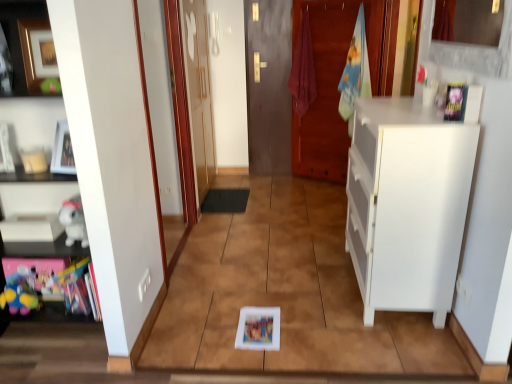
In order to face transparent glass door at upper left, the first door positioned from the left, should I rotate leftwards or rightwards?

Turn left approximately 7.461 degrees to face it.

This screenshot has height=384, width=512. What are the coordinates of `multicolored plush toy at lower left, which is the 1th toy in bottom-to-top order` in the screenshot? It's located at (20, 292).

Image resolution: width=512 pixels, height=384 pixels. Describe the element at coordinates (40, 248) in the screenshot. I see `white matte cabinet at left, marked as the 2th cabinetry in a right-to-left arrangement` at that location.

You are a GUI agent. You are given a task and a screenshot of the screen. Output one action in this format:
    pyautogui.click(x=<x>, y=<y>)
    Task: Click on the blue fabric laundry at center, the 1th laundry in the right-to-left sequence
    
    Given the screenshot: What is the action you would take?
    (x=355, y=71)

What do you see at coordinates (407, 205) in the screenshot? This screenshot has width=512, height=384. I see `white matte cabinet at right, the 2th cabinetry when ordered from left to right` at bounding box center [407, 205].

This screenshot has height=384, width=512. In order to click on white matte cabinet at right, the 2th cabinetry when ordered from left to right in this screenshot , I will do `click(407, 205)`.

What are the coordinates of `transparent glass door at upper left, the first door positioned from the left` in the screenshot? It's located at (198, 92).

At what (x,y) coordinates should I click in order to perform the action: click on cabinetry on the right side of white matte cabinet at left, marked as the 2th cabinetry in a right-to-left arrangement. Please return your answer as a coordinate pair (x, y). The width and height of the screenshot is (512, 384). Looking at the image, I should click on (407, 205).

Could you tell me if white matte cabinet at left, the 1th cabinetry positioned from the left, is facing white matte cabinet at right, the first cabinetry viewed from the right?

No, white matte cabinet at left, the 1th cabinetry positioned from the left, is not oriented towards white matte cabinet at right, the first cabinetry viewed from the right.

Which object is wider, white matte cabinet at left, marked as the 2th cabinetry in a right-to-left arrangement, or white matte cabinet at right, the first cabinetry viewed from the right?

white matte cabinet at right, the first cabinetry viewed from the right.

Looking at this image, can you confirm if white matte cabinet at left, the 1th cabinetry positioned from the left, is positioned to the left of white matte cabinet at right, the 2th cabinetry when ordered from left to right?

Correct, you'll find white matte cabinet at left, the 1th cabinetry positioned from the left, to the left of white matte cabinet at right, the 2th cabinetry when ordered from left to right.

What's the angular difference between white matte cabinet at left, marked as the 2th cabinetry in a right-to-left arrangement, and transparent glass door at upper left, acting as the 2th door starting from the right,'s facing directions?

They differ by 91.3 degrees in their facing directions.

Between white matte cabinet at left, the 1th cabinetry positioned from the left, and transparent glass door at upper left, acting as the 2th door starting from the right, which one appears on the left side from the viewer's perspective?

From the viewer's perspective, white matte cabinet at left, the 1th cabinetry positioned from the left, appears more on the left side.

Which of these two, white matte cabinet at left, the 1th cabinetry positioned from the left, or transparent glass door at upper left, the first door positioned from the left, stands shorter?

white matte cabinet at left, the 1th cabinetry positioned from the left, is shorter.

Considering the positions of points (8, 5) and (191, 113), is point (8, 5) closer to camera compared to point (191, 113)?

That is True.

In the scene shown: From their relative heights in the image, would you say blue fabric laundry at center, the 1th laundry in the right-to-left sequence, is taller or shorter than brown wooden door at center, which appears as the second door when viewed from the left?

Clearly, blue fabric laundry at center, the 1th laundry in the right-to-left sequence, is shorter compared to brown wooden door at center, which appears as the second door when viewed from the left.

From the image's perspective, which object appears higher, blue fabric laundry at center, the 1th laundry in the right-to-left sequence, or brown wooden door at center, which appears as the second door when viewed from the left?

From the image's view, brown wooden door at center, which appears as the second door when viewed from the left, is above.

Find the location of a particular element. This screenshot has height=384, width=512. the 1st laundry located above the brown wooden door at center, which appears as the second door when viewed from the left (from a real-world perspective) is located at coordinates (355, 71).

Is blue fabric laundry at center, the 2th laundry in the left-to-right sequence, not close to brown wooden door at center, which appears as the second door when viewed from the left?

Actually, blue fabric laundry at center, the 2th laundry in the left-to-right sequence, and brown wooden door at center, which appears as the second door when viewed from the left, are a little close together.

Considering the points (10, 299) and (66, 226), which point is in front, point (10, 299) or point (66, 226)?

The point (66, 226) is in front.

In the scene shown: Is multicolored plush toy at lower left, which is the 1th toy in bottom-to-top order, facing away from white plush toy at left, arranged as the 1th toy when viewed from the top?

multicolored plush toy at lower left, which is the 1th toy in bottom-to-top order, does not have its back to white plush toy at left, arranged as the 1th toy when viewed from the top.

Is multicolored plush toy at lower left, acting as the 2th toy starting from the top, in front of white plush toy at left, placed as the second toy when sorted from left to right?

No, multicolored plush toy at lower left, acting as the 2th toy starting from the top, is further to the viewer.

Would you say multicolored plush toy at lower left, marked as the first toy in a left-to-right arrangement, is inside or outside white plush toy at left, marked as the 2th toy in a bottom-to-top arrangement?

The correct answer is: outside.

Is white matte cabinet at right, the 2th cabinetry when ordered from left to right, looking in the opposite direction of matte white picture frame at upper left?

white matte cabinet at right, the 2th cabinetry when ordered from left to right, does not have its back to matte white picture frame at upper left.

This screenshot has width=512, height=384. I want to click on cabinetry that is the 2nd one below the matte white picture frame at upper left (from a real-world perspective), so click(407, 205).

Can you tell me how much white matte cabinet at right, the 2th cabinetry when ordered from left to right, and matte white picture frame at upper left differ in facing direction?

They differ by 119 degrees in their facing directions.

Which is more to the left, white matte cabinet at right, the first cabinetry viewed from the right, or matte white picture frame at upper left?

matte white picture frame at upper left.

Which laundry is the 1st one when counting from the back of the white plush toy at left, placed as the second toy when sorted from left to right? Please provide its 2D coordinates.

[(355, 71)]

Which object is more forward, white plush toy at left, arranged as the 1th toy when viewed from the top, or blue fabric laundry at center, the 2th laundry in the left-to-right sequence?

white plush toy at left, arranged as the 1th toy when viewed from the top, is closer to the camera.

Considering the positions of objects white plush toy at left, placed as the second toy when sorted from left to right, and blue fabric laundry at center, the 2th laundry in the left-to-right sequence, in the image provided, who is more to the right, white plush toy at left, placed as the second toy when sorted from left to right, or blue fabric laundry at center, the 2th laundry in the left-to-right sequence,?

Positioned to the right is blue fabric laundry at center, the 2th laundry in the left-to-right sequence.

Can you confirm if white plush toy at left, arranged as the 1th toy when viewed from the top, is smaller than blue fabric laundry at center, the 1th laundry in the right-to-left sequence?

Yes.

Consider the image. Is multicolored plush toy at lower left, arranged as the second toy when viewed from the right, smaller than black rubber mat at center?

Indeed, multicolored plush toy at lower left, arranged as the second toy when viewed from the right, has a smaller size compared to black rubber mat at center.

Does point (24, 303) appear closer or farther from the camera than point (213, 206)?

Point (24, 303) appears to be closer to the viewer than point (213, 206).

Is multicolored plush toy at lower left, arranged as the second toy when viewed from the right, facing away from black rubber mat at center?

Absolutely, multicolored plush toy at lower left, arranged as the second toy when viewed from the right, is directed away from black rubber mat at center.

In the image, there is a white matte cabinet at right, the 2th cabinetry when ordered from left to right. What are the coordinates of `cabinetry above it (from the image's perspective)` in the screenshot? It's located at (40, 248).

Find the location of `the 1st door counting from the right of the white matte cabinet at left, the 1th cabinetry positioned from the left`. the 1st door counting from the right of the white matte cabinet at left, the 1th cabinetry positioned from the left is located at coordinates (198, 92).

Estimate the real-world distances between objects in this image. Which object is closer to blue fabric laundry at center, the 1th laundry in the right-to-left sequence, multicolored plush toy at lower left, which is the 1th toy in bottom-to-top order, or matte red towel at center, acting as the first laundry starting from the left?

matte red towel at center, acting as the first laundry starting from the left.

Considering their positions, is blue fabric laundry at center, the 1th laundry in the right-to-left sequence, positioned further to transparent glass door at upper left, acting as the 2th door starting from the right, than white matte cabinet at left, marked as the 2th cabinetry in a right-to-left arrangement?

The object further to transparent glass door at upper left, acting as the 2th door starting from the right, is white matte cabinet at left, marked as the 2th cabinetry in a right-to-left arrangement.

Considering their positions, is transparent glass door at upper left, acting as the 2th door starting from the right, positioned further to multicolored plush toy at lower left, which is the 1th toy in bottom-to-top order, than black rubber mat at center?

The object further to multicolored plush toy at lower left, which is the 1th toy in bottom-to-top order, is transparent glass door at upper left, acting as the 2th door starting from the right.

Estimate the real-world distances between objects in this image. Which object is further from multicolored plush toy at lower left, arranged as the second toy when viewed from the right, matte white picture frame at upper left or white matte cabinet at left, marked as the 2th cabinetry in a right-to-left arrangement?

Among the two, matte white picture frame at upper left is located further to multicolored plush toy at lower left, arranged as the second toy when viewed from the right.

When comparing their distances from transparent glass door at upper left, acting as the 2th door starting from the right, does white plush toy at left, which appears as the 1th toy when viewed from the right, or blue fabric laundry at center, the 1th laundry in the right-to-left sequence, seem further?

white plush toy at left, which appears as the 1th toy when viewed from the right.

Looking at the image, which one is located closer to multicolored plush toy at lower left, acting as the 2th toy starting from the top, white matte cabinet at right, the first cabinetry viewed from the right, or transparent glass door at upper left, the first door positioned from the left?

white matte cabinet at right, the first cabinetry viewed from the right, is closer to multicolored plush toy at lower left, acting as the 2th toy starting from the top.

Considering their positions, is white plush toy at left, which appears as the 1th toy when viewed from the right, positioned closer to matte white picture frame at upper left than multicolored plush toy at lower left, marked as the first toy in a left-to-right arrangement?

white plush toy at left, which appears as the 1th toy when viewed from the right, lies closer to matte white picture frame at upper left than the other object.

From the image, which object appears to be farther from white matte cabinet at right, the 2th cabinetry when ordered from left to right, black rubber mat at center or transparent glass door at upper left, acting as the 2th door starting from the right?

Based on the image, transparent glass door at upper left, acting as the 2th door starting from the right, appears to be further to white matte cabinet at right, the 2th cabinetry when ordered from left to right.

Where is `laundry located between transparent glass door at upper left, the first door positioned from the left, and blue fabric laundry at center, the 2th laundry in the left-to-right sequence, in the left-right direction`? The height and width of the screenshot is (384, 512). laundry located between transparent glass door at upper left, the first door positioned from the left, and blue fabric laundry at center, the 2th laundry in the left-to-right sequence, in the left-right direction is located at coordinates pos(303,70).

The width and height of the screenshot is (512, 384). What are the coordinates of `laundry between multicolored plush toy at lower left, marked as the first toy in a left-to-right arrangement, and white matte cabinet at right, the 2th cabinetry when ordered from left to right` in the screenshot? It's located at (303, 70).

I want to click on door located between white plush toy at left, marked as the 2th toy in a bottom-to-top arrangement, and matte red towel at center, acting as the first laundry starting from the left, in the depth direction, so click(198, 92).

At what (x,y) coordinates should I click in order to perform the action: click on toy between white plush toy at left, placed as the second toy when sorted from left to right, and brown wooden door at center, which appears as the second door when viewed from the left, in the front-back direction. Please return your answer as a coordinate pair (x, y). The height and width of the screenshot is (384, 512). Looking at the image, I should click on (20, 292).